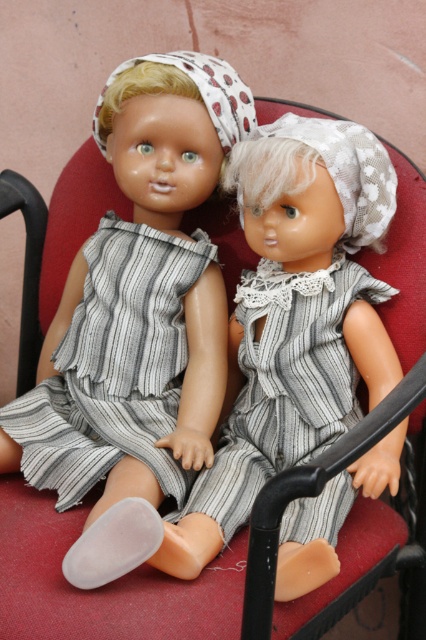
Question: Can you confirm if gray striped fabric dress at left is smaller than striped fabric dress at center?

Choices:
 (A) yes
 (B) no

Answer: (A)

Question: Which of the following is the farthest from the observer?

Choices:
 (A) gray striped fabric dress at left
 (B) striped fabric dress at center

Answer: (A)

Question: Is the position of gray striped fabric dress at left more distant than that of striped fabric dress at center?

Choices:
 (A) no
 (B) yes

Answer: (B)

Question: Observing the image, what is the correct spatial positioning of gray striped fabric dress at left in reference to striped fabric dress at center?

Choices:
 (A) left
 (B) right

Answer: (A)